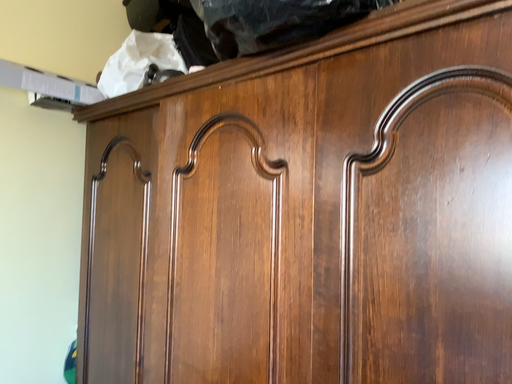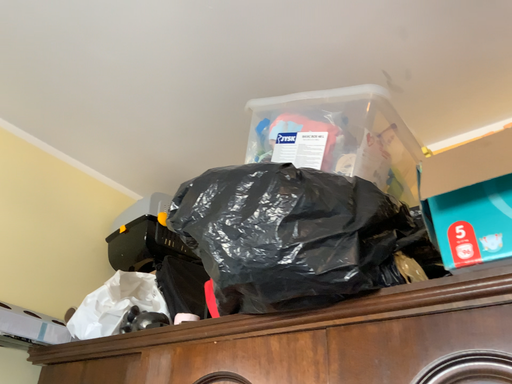
Question: Which way did the camera rotate in the video?

Choices:
 (A) rotated upward
 (B) rotated downward

Answer: (A)